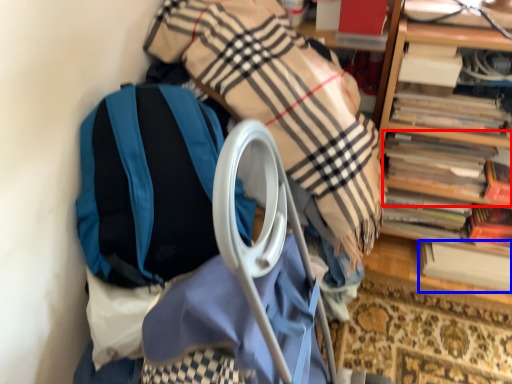
Question: Which object appears farthest to the camera in this image, book (highlighted by a red box) or book (highlighted by a blue box)?

Choices:
 (A) book
 (B) book

Answer: (B)